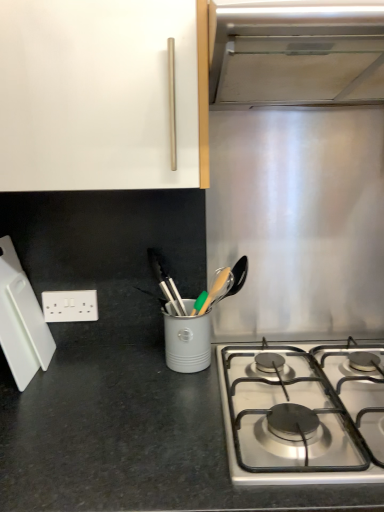
Question: Considering the positions of white plastic cutting board at left and white plastic electric outlet at lower left in the image, is white plastic cutting board at left taller or shorter than white plastic electric outlet at lower left?

Choices:
 (A) tall
 (B) short

Answer: (A)

Question: Choose the correct answer: Is white plastic cutting board at left inside white plastic electric outlet at lower left or outside it?

Choices:
 (A) outside
 (B) inside

Answer: (A)

Question: Estimate the real-world distances between objects in this image. Which object is farther from the white plastic electric outlet at lower left?

Choices:
 (A) white plastic cutting board at left
 (B) stainless steel gas stove at lower right
 (C) stainless steel vent at upper right
 (D) white glossy cabinet handle at upper center

Answer: (C)

Question: Which object is positioned closest to the white glossy cabinet handle at upper center?

Choices:
 (A) white plastic electric outlet at lower left
 (B) white plastic cutting board at left
 (C) stainless steel gas stove at lower right
 (D) stainless steel vent at upper right

Answer: (D)